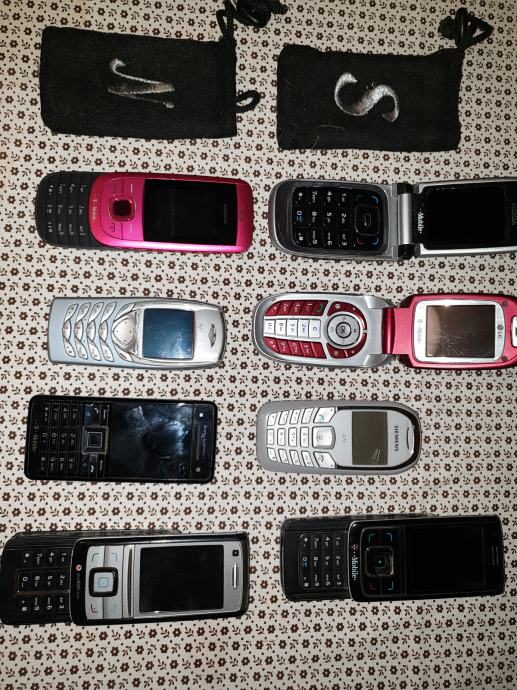
Locate an element on the screen. screens is located at coordinates (188, 210), (167, 325), (155, 428), (189, 584), (454, 555), (373, 428), (465, 325), (468, 217).